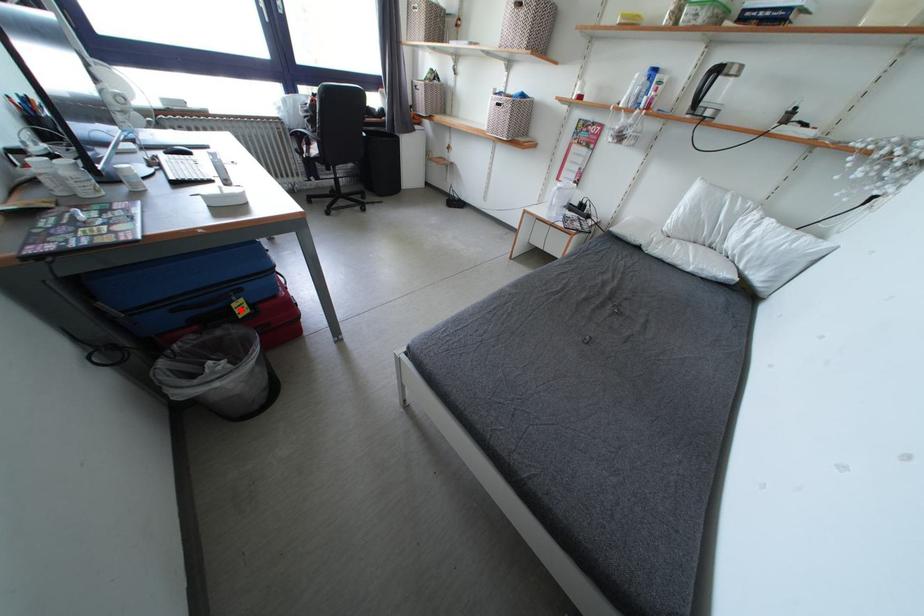
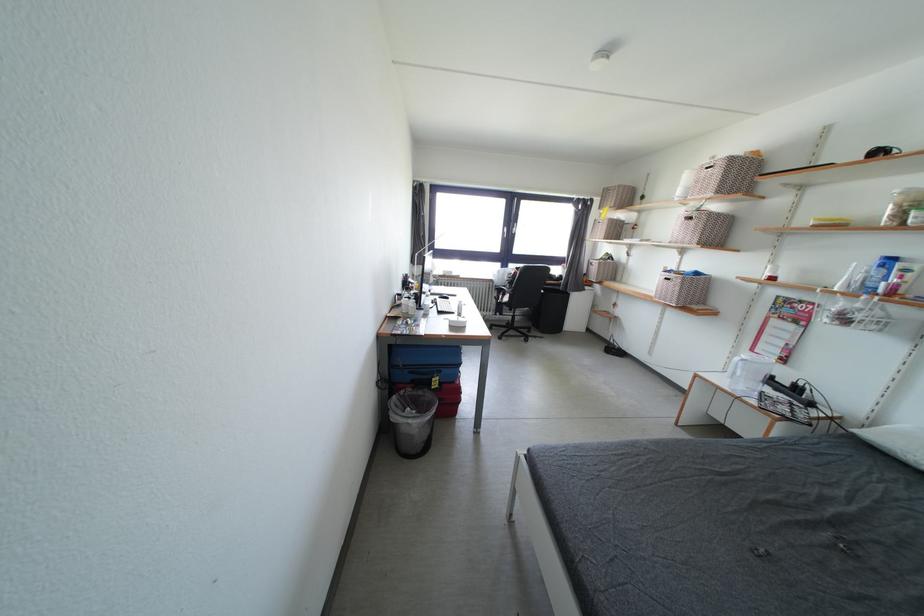
Question: A red point is marked in image1. In image2, is the corresponding 3D point closer to the camera or farther? Reply with the corresponding letter.

Choices:
 (A) The corresponding 3D point is closer.
 (B) The corresponding 3D point is farther.

Answer: (B)